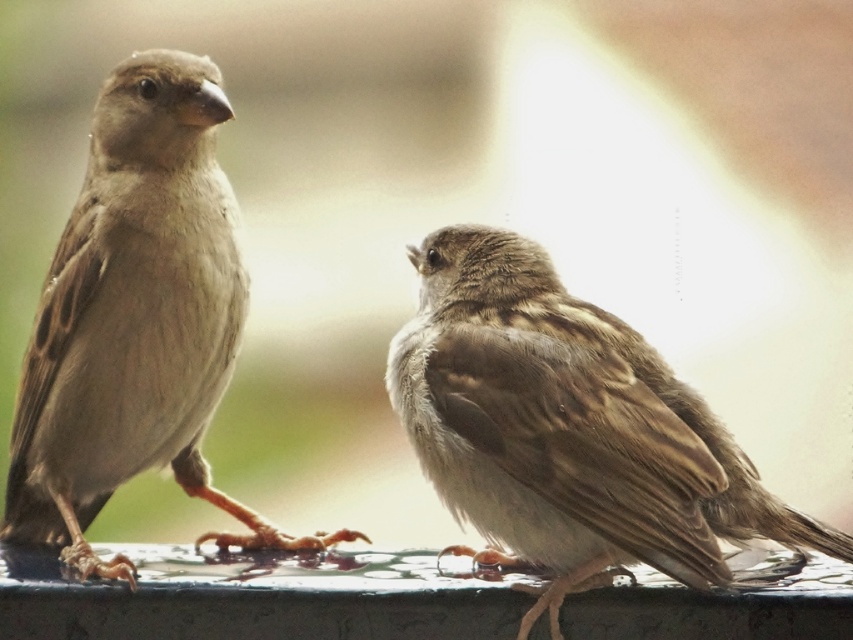
Question: Can you confirm if brown feathered sparrow at center is positioned to the right of brown feathered sparrow at left?

Choices:
 (A) no
 (B) yes

Answer: (B)

Question: Which point is farther to the camera?

Choices:
 (A) brown feathered sparrow at left
 (B) brown feathered sparrow at center

Answer: (A)

Question: Which point is closer to the camera?

Choices:
 (A) (71, 317)
 (B) (467, 364)

Answer: (B)

Question: Does brown feathered sparrow at center have a larger size compared to brown feathered sparrow at left?

Choices:
 (A) yes
 (B) no

Answer: (B)

Question: Which object is farther from the camera taking this photo?

Choices:
 (A) brown feathered sparrow at center
 (B) brown feathered sparrow at left

Answer: (B)

Question: Can you confirm if brown feathered sparrow at center is thinner than brown feathered sparrow at left?

Choices:
 (A) no
 (B) yes

Answer: (A)